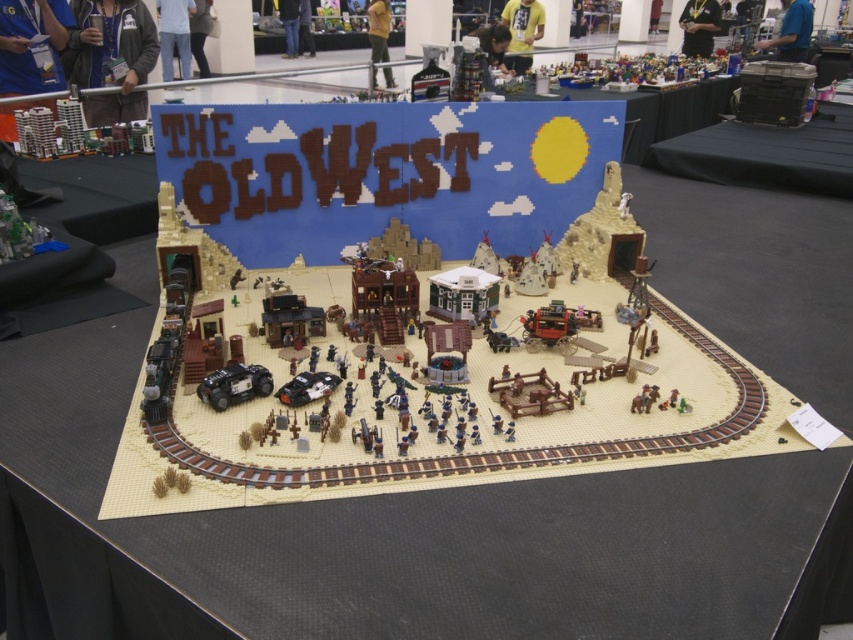
Does matte plastic toy at upper center appear over dark gray plastic car at center?

Indeed, matte plastic toy at upper center is positioned over dark gray plastic car at center.

How far apart are matte plastic toy at upper center and dark gray plastic car at center?

matte plastic toy at upper center and dark gray plastic car at center are 10.67 feet apart from each other.

Which is in front, point (596, 67) or point (231, 392)?

Point (231, 392) is in front.

Find the location of a particular element. matte plastic toy at upper center is located at coordinates [x=640, y=68].